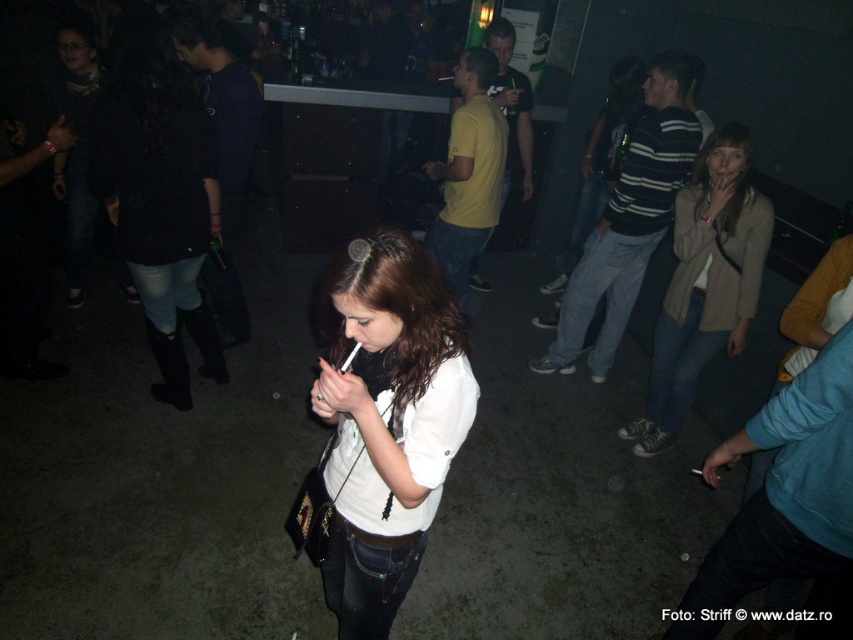
Does white matte shirt at center have a smaller size compared to beige textured coat at right?

Yes.

This screenshot has height=640, width=853. In order to click on white matte shirt at center in this screenshot , I will do `click(387, 419)`.